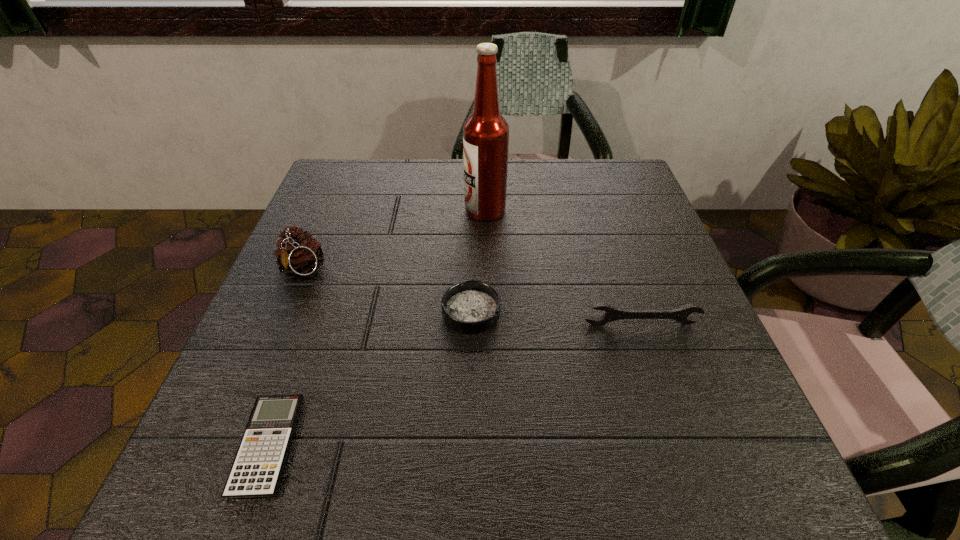
The height and width of the screenshot is (540, 960). Identify the location of free space located on the label side of the tallest object. (356, 211).

What are the coordinates of `free space located with a leaf charm attached to the fourth shortest object` in the screenshot? It's located at (239, 419).

Find the location of a particular element. vacant space located 0.300m on the open ends of the wrench is located at coordinates tap(701, 500).

The width and height of the screenshot is (960, 540). Find the location of `vacant space located on the back of the ashtray`. vacant space located on the back of the ashtray is located at coordinates (472, 260).

The image size is (960, 540). Identify the location of vacant space located on the back of the nearest object. (334, 259).

The width and height of the screenshot is (960, 540). I want to click on object located in the far edge section of the desktop, so click(x=485, y=133).

This screenshot has height=540, width=960. In order to click on object located in the near edge section of the desktop in this screenshot , I will do `click(256, 472)`.

Where is `pinecone at the left edge`? The image size is (960, 540). pinecone at the left edge is located at coordinates (299, 253).

Locate an element on the screen. calculator located at the left edge is located at coordinates (256, 472).

At what (x,y) coordinates should I click in order to perform the action: click on object positioned at the right edge. Please return your answer as a coordinate pair (x, y). Looking at the image, I should click on 681,315.